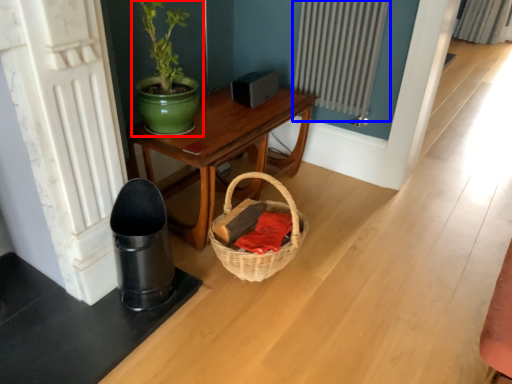
Question: Which of the following is the farthest to the observer, houseplant (highlighted by a red box) or radiator (highlighted by a blue box)?

Choices:
 (A) houseplant
 (B) radiator

Answer: (B)